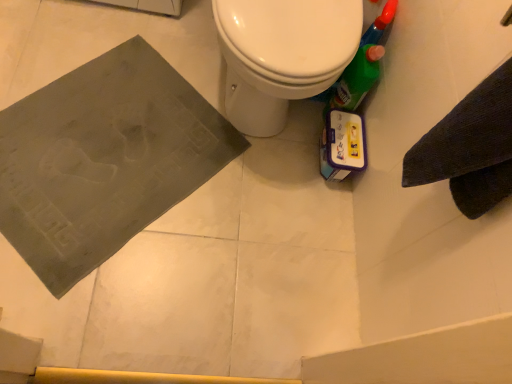
Identify the location of free space to the right of dark gray rubber mat at lower left. (265, 225).